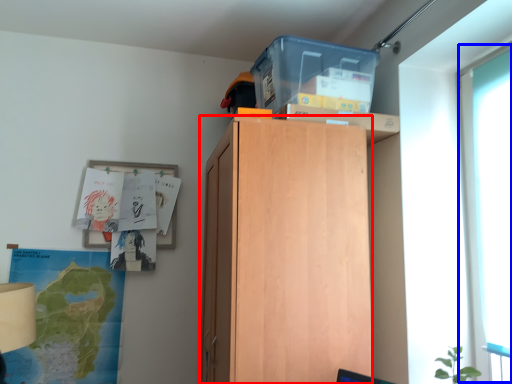
Question: Which object is further to the camera taking this photo, cabinetry (highlighted by a red box) or glass door (highlighted by a blue box)?

Choices:
 (A) cabinetry
 (B) glass door

Answer: (A)